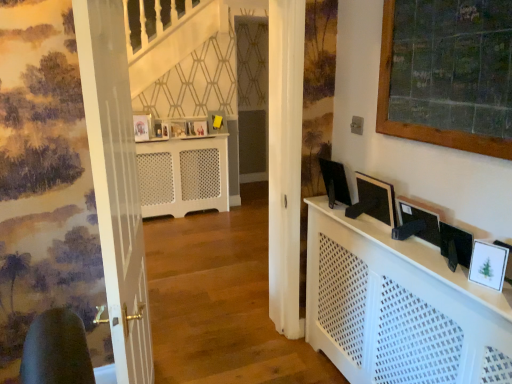
Identify the location of vacant area on the back side of matte wooden picture frame at upper center, the 2th picture frame viewed from the front. (152, 135).